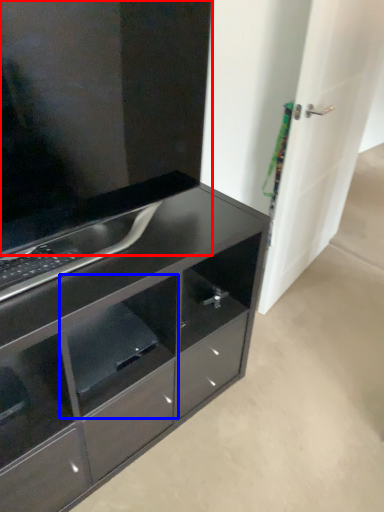
Question: Which of the following is the closest to the observer, cabinetry (highlighted by a red box) or shelf (highlighted by a blue box)?

Choices:
 (A) cabinetry
 (B) shelf

Answer: (A)